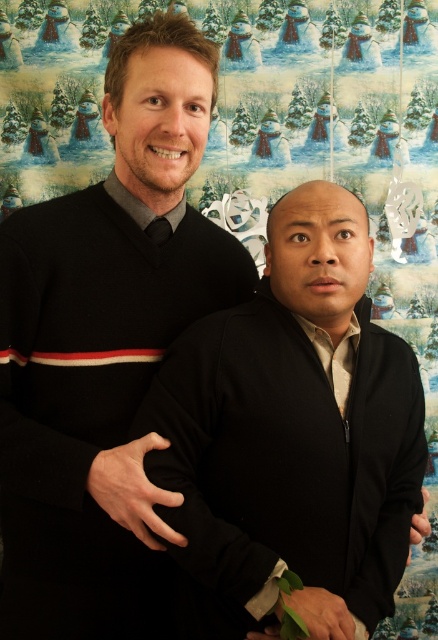
Who is taller, black matte sweater at left or black matte sweater at center?

black matte sweater at left

In the scene shown: Which of these two, black matte sweater at left or black matte sweater at center, stands shorter?

Standing shorter between the two is black matte sweater at center.

Locate an element on the screen. This screenshot has height=640, width=438. black matte sweater at left is located at coordinates (105, 348).